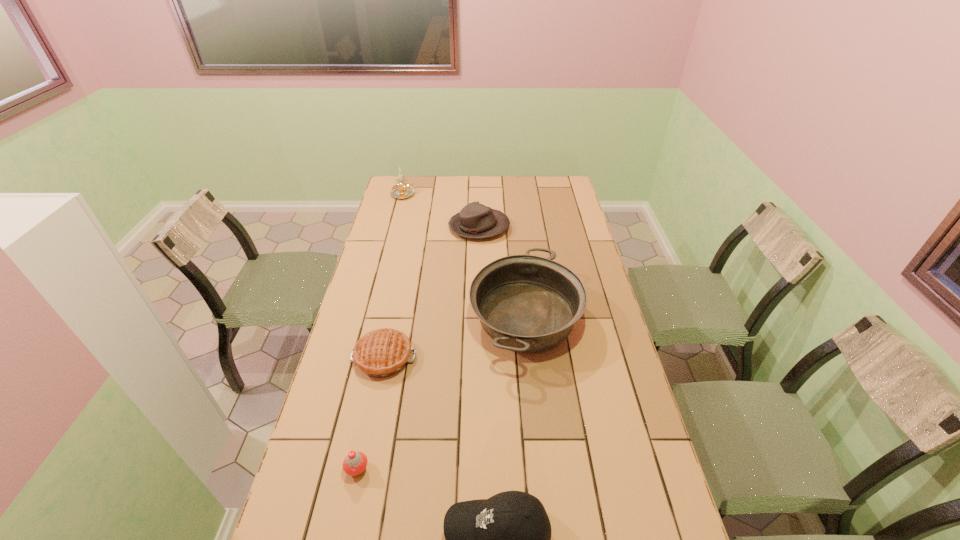
Where is `vacant space at the far right corner`? vacant space at the far right corner is located at coordinates (551, 193).

Find the location of a particular element. vacant area that lies between the pie and the cupcake is located at coordinates (371, 414).

The image size is (960, 540). In order to click on vacant area that lies between the pie and the second nearest object in this screenshot , I will do `click(371, 414)`.

At what (x,y) coordinates should I click in order to perform the action: click on free spot between the pan and the pie. Please return your answer as a coordinate pair (x, y). The width and height of the screenshot is (960, 540). Looking at the image, I should click on (455, 338).

In order to click on vacant space that's between the fifth nearest object and the farthest object in this screenshot , I will do `click(441, 210)`.

The height and width of the screenshot is (540, 960). I want to click on vacant space that's between the second nearest object and the fifth nearest object, so click(x=419, y=348).

Identify the location of vacant region between the fourth tallest object and the pie. The image size is (960, 540). (431, 293).

Where is `vacant space that is in between the pie and the second nearest object`? The image size is (960, 540). vacant space that is in between the pie and the second nearest object is located at coordinates (371, 414).

Choose which object is the fifth nearest neighbor to the cupcake. Please provide its 2D coordinates. Your answer should be formatted as a tuple, i.e. [(x, y)], where the tuple contains the x and y coordinates of a point satisfying the conditions above.

[(403, 190)]

Identify which object is located as the fourth nearest to the pie. Please provide its 2D coordinates. Your answer should be formatted as a tuple, i.e. [(x, y)], where the tuple contains the x and y coordinates of a point satisfying the conditions above.

[(475, 220)]